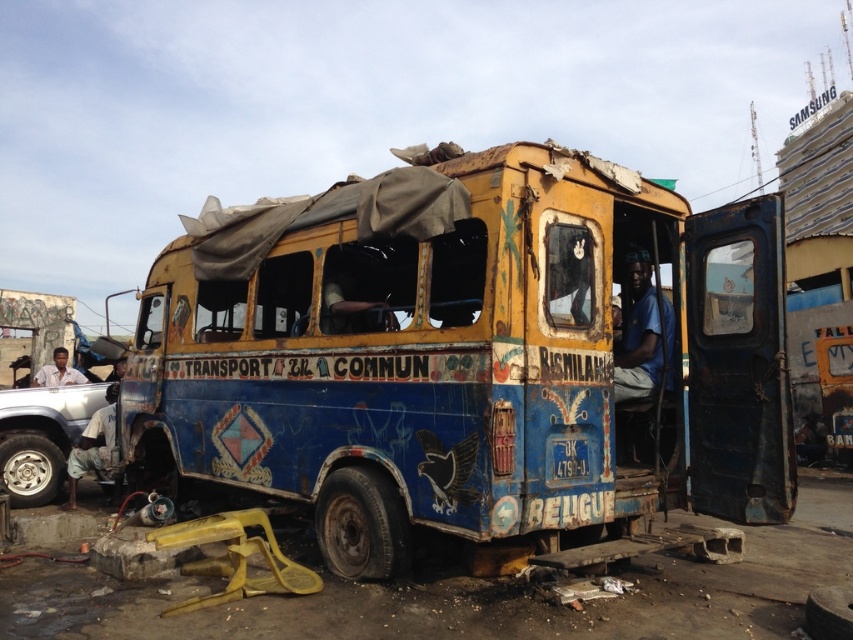
You are a pedestrian standing at the edge of the road. You see the rusty metal bus at center and the silver metallic car at lower left. Which vehicle is higher up from the ground?

The rusty metal bus at center is located above the silver metallic car at lower left, so it is higher up from the ground.